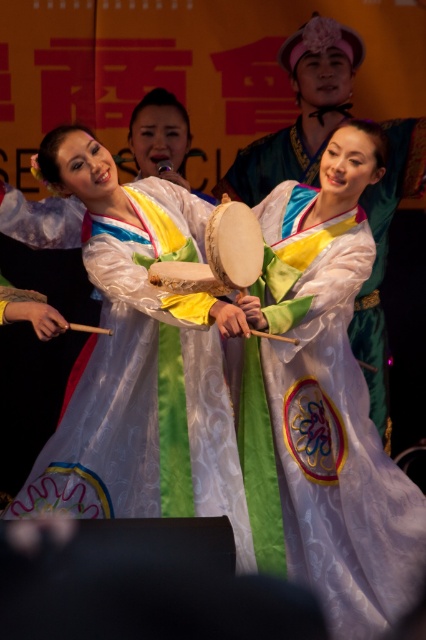
You are a photographer standing in front of the silky white robe at center during a cultural performance. You want to capture a closeup shot of the robe without moving closer than 5 meters. Is the distance sufficient for your camera to focus properly?

The silky white robe at center is 6.11 meters away from the viewer. Since your minimum focusing distance is 5 meters, the robe is beyond the required distance, so the camera can focus properly.

You are a photographer at the back of the stage. You need to capture a photo that includes both the silky white robe at center and the white satin dress at center. Which object should you zoom in on to ensure both are in frame without cropping?

To include both the silky white robe at center and the white satin dress at center in the frame without cropping, you should zoom in on the smaller object, which is the silky white robe at center, since it is smaller and closer to the camera than the larger white satin dress at center.

You are a photographer at the back of the stage. You see the white satin dress at center and the light brown wooden drum at center. Which object is closer to the camera?

The light brown wooden drum at center is closer to the camera because the white satin dress at center is below it, meaning the drum is positioned above the dress and thus nearer to the photographer observing from the back of the stage.